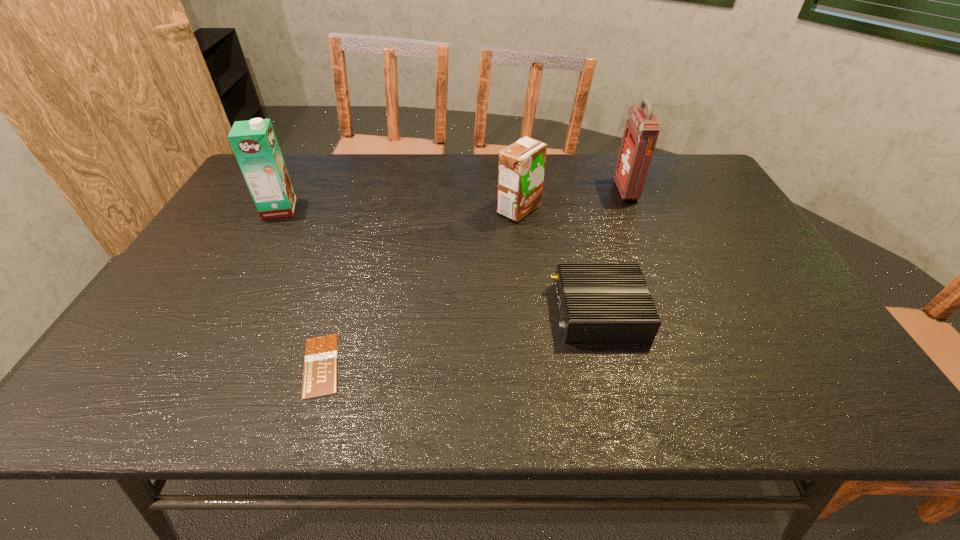
At what (x,y) coordinates should I click in order to perform the action: click on object present at the near edge. Please return your answer as a coordinate pair (x, y). The width and height of the screenshot is (960, 540). Looking at the image, I should click on (320, 365).

I want to click on object positioned at the left edge, so click(x=254, y=142).

The width and height of the screenshot is (960, 540). In order to click on free space at the far edge in this screenshot , I will do `click(553, 188)`.

The width and height of the screenshot is (960, 540). In order to click on vacant space at the near edge of the desktop in this screenshot , I will do `click(357, 403)`.

Image resolution: width=960 pixels, height=540 pixels. In the image, there is a desktop. What are the coordinates of `free space at the left edge` in the screenshot? It's located at (214, 299).

The height and width of the screenshot is (540, 960). Identify the location of vacant space at the right edge of the desktop. (709, 240).

You are a GUI agent. You are given a task and a screenshot of the screen. Output one action in this format:
    pyautogui.click(x=<x>, y=<y>)
    Task: Click on the vacant area at the near right corner
    
    Given the screenshot: What is the action you would take?
    pyautogui.click(x=779, y=386)

Image resolution: width=960 pixels, height=540 pixels. Identify the location of free spot between the router and the taller carton. (440, 260).

Find the location of a particular element. Image resolution: width=960 pixels, height=540 pixels. vacant region between the second object from left to right and the taller carton is located at coordinates coord(300,287).

At what (x,y) coordinates should I click in order to perform the action: click on free point between the shortest object and the rightmost object. Please return your answer as a coordinate pair (x, y). The image size is (960, 540). Looking at the image, I should click on (473, 278).